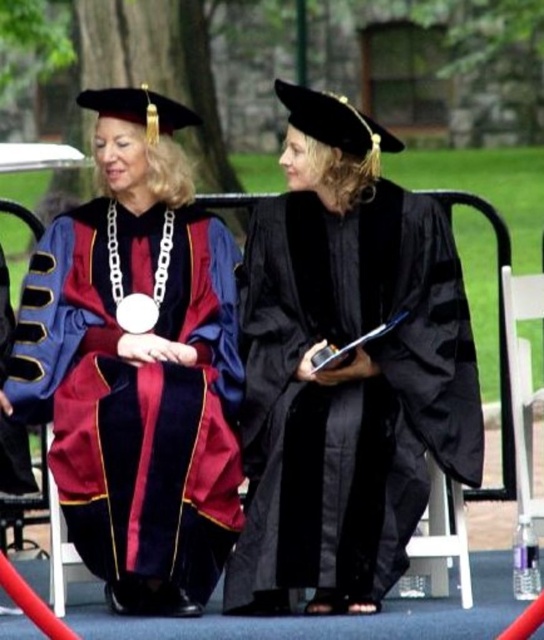
You are attending a graduation ceremony and see two graduates wearing maroon velvet gown at center and black matte graduation gown at center. Which graduate is sitting on the left side?

The maroon velvet gown at center is to the left of black matte graduation gown at center, so the graduate wearing the maroon velvet gown at center is sitting on the left side.

Please describe the location of the maroon velvet gown at center in the image using the coordinate system provided in the Objects Description.

The maroon velvet gown at center is located at point coordinates of [138,364].